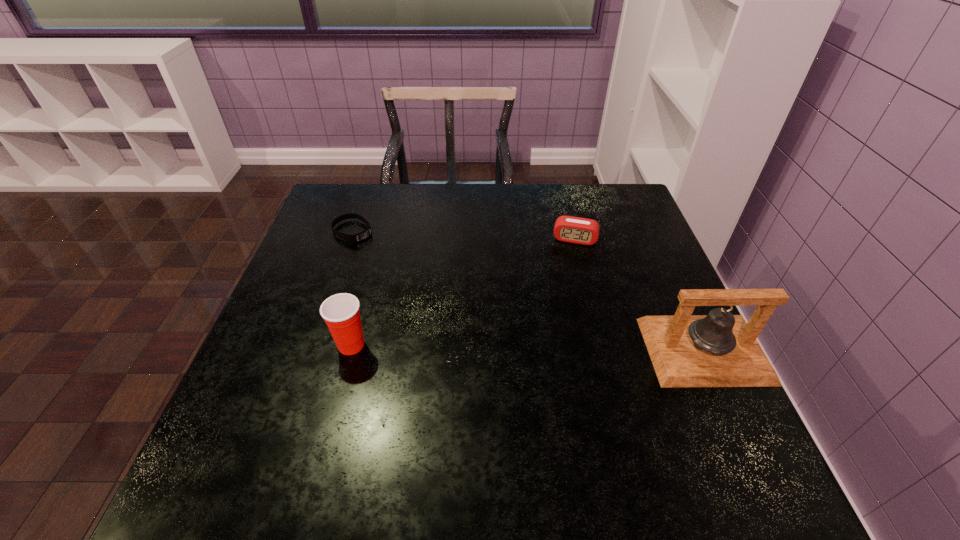
Locate an element on the screen. This screenshot has height=540, width=960. vacant space situated on the front-facing side of the second object from right to left is located at coordinates (567, 268).

Find the location of `free location located 0.290m on the display of the wristband`. free location located 0.290m on the display of the wristband is located at coordinates (439, 287).

This screenshot has height=540, width=960. Identify the location of free region located on the display of the wristband. [x=447, y=293].

You are a GUI agent. You are given a task and a screenshot of the screen. Output one action in this format:
    pyautogui.click(x=<x>, y=<y>)
    Task: Click on the vacant space located 0.200m on the display of the wristband
    Image resolution: width=960 pixels, height=540 pixels.
    Given the screenshot: What is the action you would take?
    pyautogui.click(x=414, y=271)

Locate an element on the screen. object that is at the far edge is located at coordinates (355, 238).

This screenshot has width=960, height=540. I want to click on Dixie cup present at the left edge, so click(341, 313).

Identify the location of wristband positioned at the left edge. (355, 238).

You are a GUI agent. You are given a task and a screenshot of the screen. Output one action in this format:
    pyautogui.click(x=<x>, y=<y>)
    Task: Click on the bell that is at the right edge
    The height and width of the screenshot is (540, 960).
    Given the screenshot: What is the action you would take?
    pyautogui.click(x=720, y=349)

I want to click on alarm clock at the right edge, so click(x=570, y=229).

Identify the location of object that is at the far left corner. (355, 238).